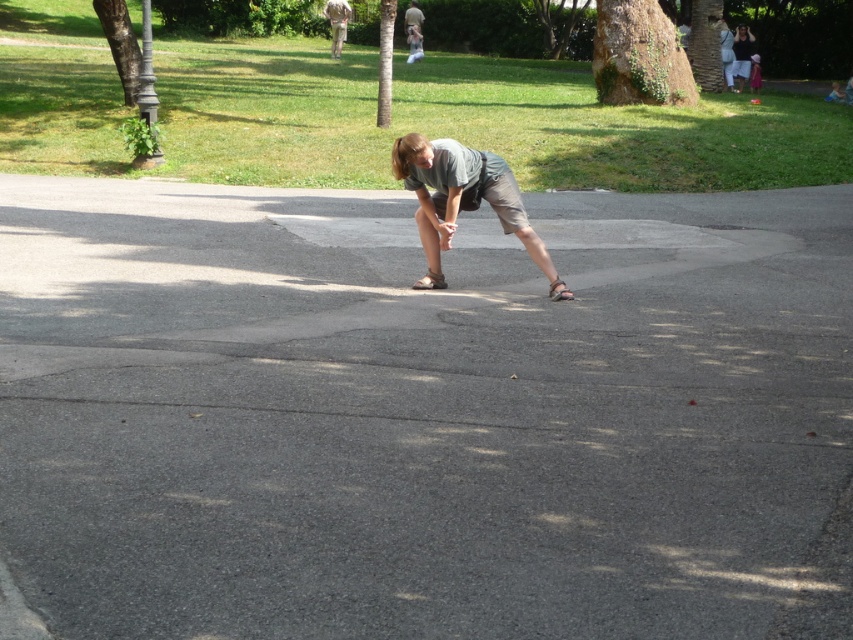
Question: Among these points, which one is farthest from the camera?

Choices:
 (A) (759, 84)
 (B) (431, 465)
 (C) (418, 157)
 (D) (747, 60)

Answer: (A)

Question: Which object is positioned farthest from the matte gray shirt at upper right?

Choices:
 (A) pink fabric dress at lower right
 (B) gray cotton shorts at center
 (C) green grass at upper center

Answer: (B)

Question: Does gray asphalt at center appear over pink fabric dress at lower right?

Choices:
 (A) no
 (B) yes

Answer: (A)

Question: Is green grass at upper center positioned at the back of gray cotton shorts at center?

Choices:
 (A) no
 (B) yes

Answer: (B)

Question: Which of the following is the closest to the observer?

Choices:
 (A) pink fabric dress at lower right
 (B) gray cotton shorts at center

Answer: (B)

Question: Is gray asphalt at center behind green grass at upper center?

Choices:
 (A) no
 (B) yes

Answer: (A)